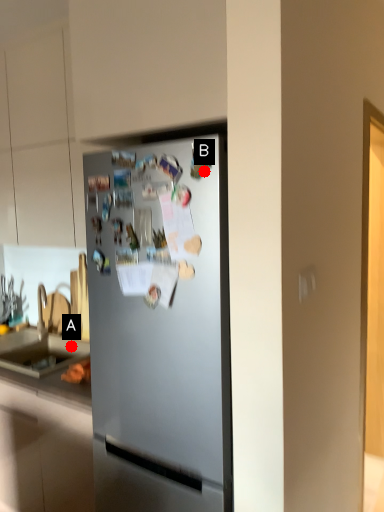
Question: Two points are circled on the image, labeled by A and B beside each circle. Which point appears farthest from the camera in this image?

Choices:
 (A) A is further
 (B) B is further

Answer: (A)